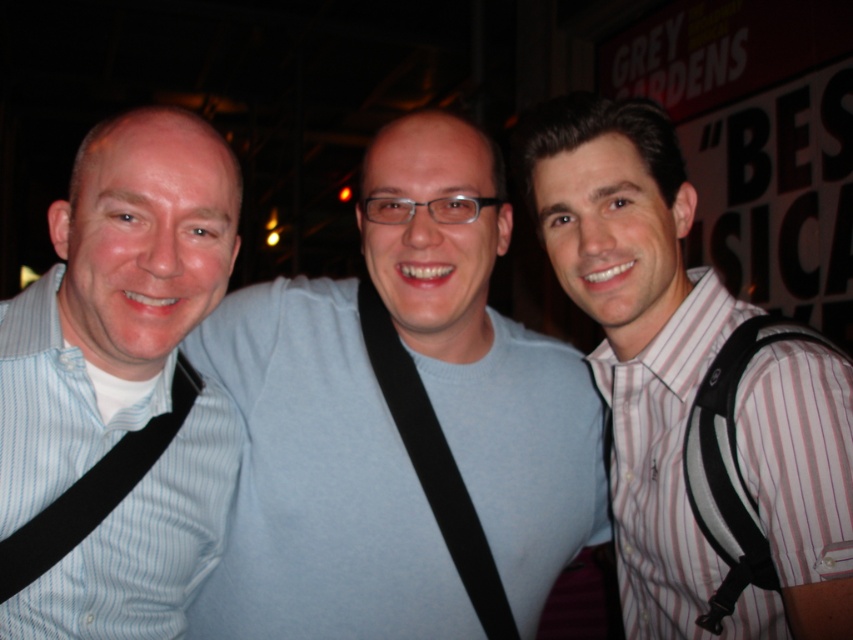
Is point (48, 445) positioned behind point (496, 625)?

No, (48, 445) is in front of (496, 625).

Locate an element on the screen. This screenshot has height=640, width=853. blue striped shirt at left is located at coordinates (119, 387).

Can you confirm if blue striped shirt at left is thinner than black fabric strap at left?

Incorrect, blue striped shirt at left's width is not less than black fabric strap at left's.

Locate an element on the screen. The height and width of the screenshot is (640, 853). blue striped shirt at left is located at coordinates (119, 387).

You are a GUI agent. You are given a task and a screenshot of the screen. Output one action in this format:
    pyautogui.click(x=<x>, y=<y>)
    Task: Click on the blue striped shirt at left
    The width and height of the screenshot is (853, 640).
    Given the screenshot: What is the action you would take?
    pyautogui.click(x=119, y=387)

Based on the photo, how distant is light blue sweater at center from striped cotton shirt at right?

light blue sweater at center is 28.47 centimeters from striped cotton shirt at right.

Does light blue sweater at center have a greater height compared to striped cotton shirt at right?

Correct, light blue sweater at center is much taller as striped cotton shirt at right.

What do you see at coordinates (318, 481) in the screenshot?
I see `light blue sweater at center` at bounding box center [318, 481].

This screenshot has width=853, height=640. Find the location of `light blue sweater at center`. light blue sweater at center is located at coordinates (318, 481).